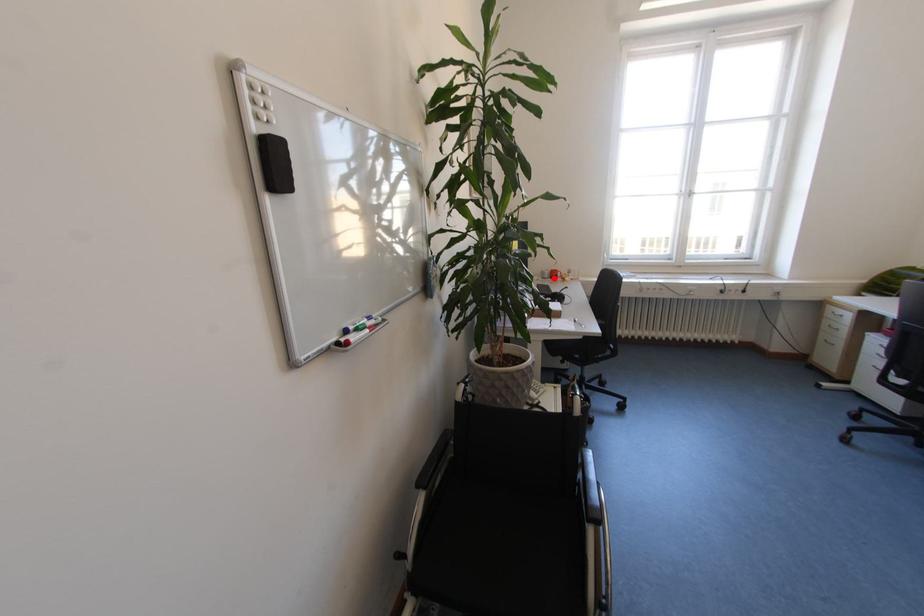
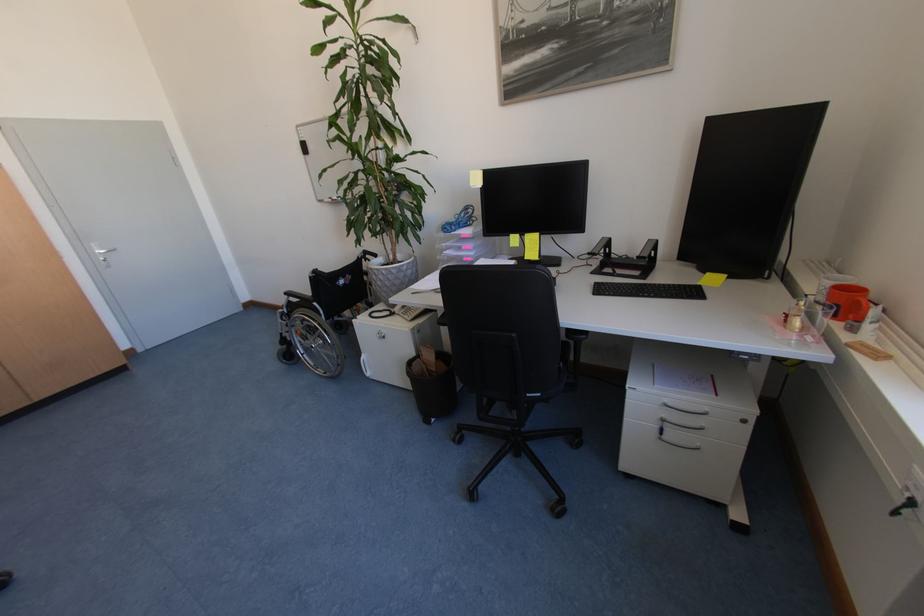
Find the pixel in the second image that matches the highlighted location in the first image.

(824, 300)